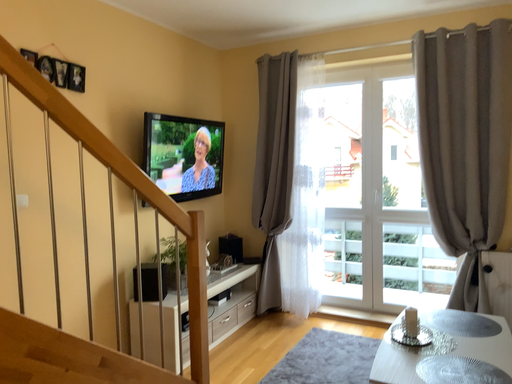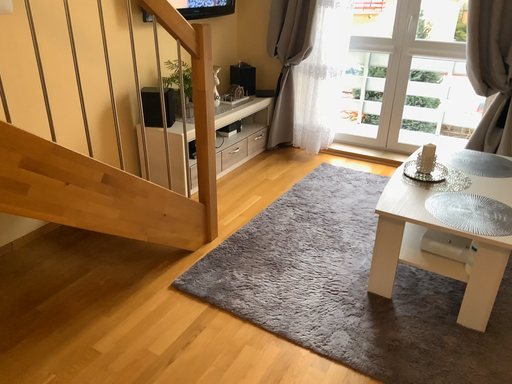
Question: Which way did the camera rotate in the video?

Choices:
 (A) rotated upward
 (B) rotated downward

Answer: (B)